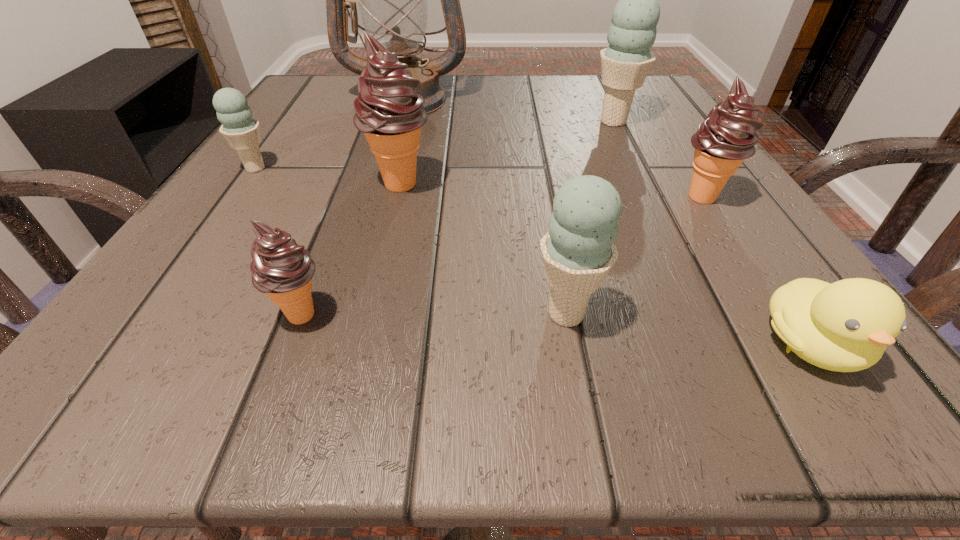
The image size is (960, 540). In order to click on free space at the near edge of the desktop in this screenshot , I will do `click(423, 374)`.

Locate an element on the screen. The width and height of the screenshot is (960, 540). vacant space at the left edge is located at coordinates (195, 291).

At what (x,y) coordinates should I click in order to perform the action: click on blank space at the right edge. Please return your answer as a coordinate pair (x, y). Image resolution: width=960 pixels, height=540 pixels. Looking at the image, I should click on (647, 127).

Find the location of a particular element. Image resolution: width=960 pixels, height=540 pixels. vacant region at the far left corner of the desktop is located at coordinates (347, 112).

This screenshot has width=960, height=540. What are the coordinates of `vacant area at the near left corner` in the screenshot? It's located at (94, 390).

The width and height of the screenshot is (960, 540). Identify the location of vacant space at the far right corner of the desktop. (672, 119).

Identify the location of vacant space at the near right corner of the desktop. (775, 369).

Where is `vacant space that's between the second farthest blue ice cream and the duckling`? The image size is (960, 540). vacant space that's between the second farthest blue ice cream and the duckling is located at coordinates (533, 256).

Image resolution: width=960 pixels, height=540 pixels. Identify the location of vacant region between the second biggest chocolate icecream and the oil lamp. (554, 148).

This screenshot has width=960, height=540. What are the coordinates of `free space between the second blue ice cream from right to left and the biggest chocolate icecream` in the screenshot? It's located at pos(483,249).